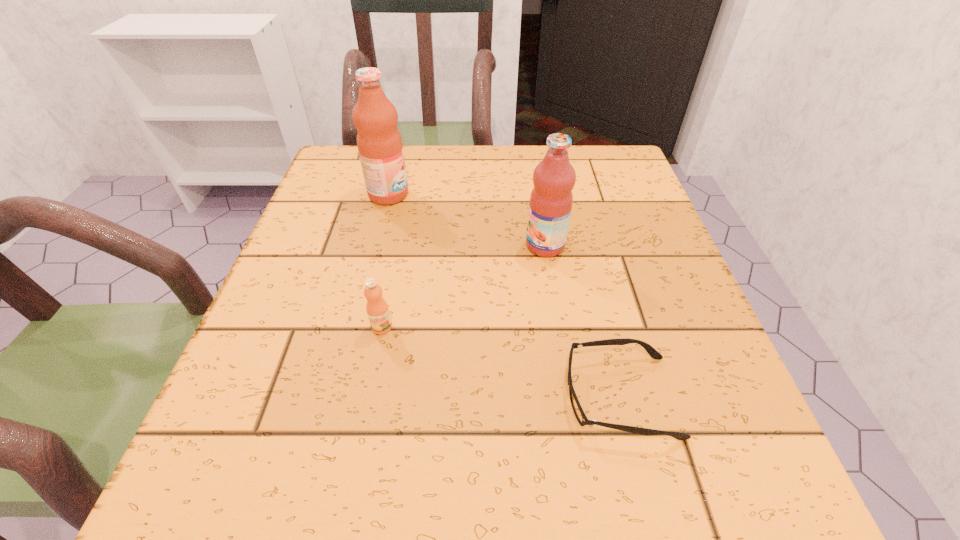
What are the coordinates of `unoccupied position between the shorter fruit juice and the taller fruit juice` in the screenshot? It's located at (467, 220).

At what (x,y) coordinates should I click in order to perform the action: click on unoccupied position between the third farthest object and the left fruit juice. Please return your answer as a coordinate pair (x, y). This screenshot has height=540, width=960. Looking at the image, I should click on [x=385, y=261].

Where is `free point between the left fruit juice and the nearest object`? free point between the left fruit juice and the nearest object is located at coordinates (504, 295).

Locate an element on the screen. vacant space in between the shorter fruit juice and the spectacles is located at coordinates (583, 321).

In order to click on free space between the orange juice and the right fruit juice in this screenshot , I will do `click(464, 286)`.

The image size is (960, 540). I want to click on free space between the second tallest object and the orange juice, so click(464, 286).

Locate an element on the screen. This screenshot has width=960, height=540. empty space between the right fruit juice and the taller fruit juice is located at coordinates (467, 220).

Identify the location of vacant space that is in between the orange juice and the farther fruit juice. This screenshot has height=540, width=960. (385, 261).

Identify the location of object that is the closest to the farther fruit juice. (551, 199).

The height and width of the screenshot is (540, 960). What are the coordinates of `object that is the third closest one to the orange juice` in the screenshot? It's located at (379, 142).